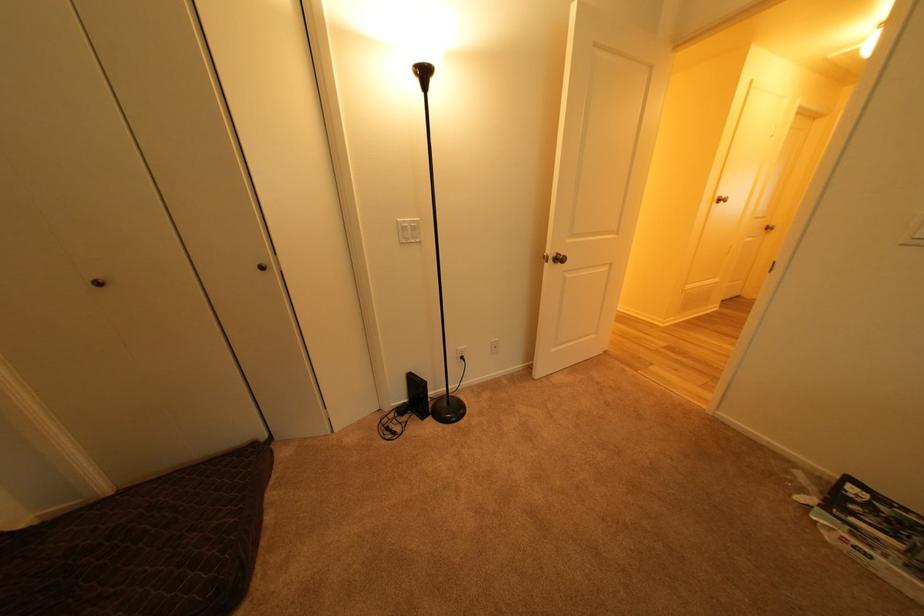
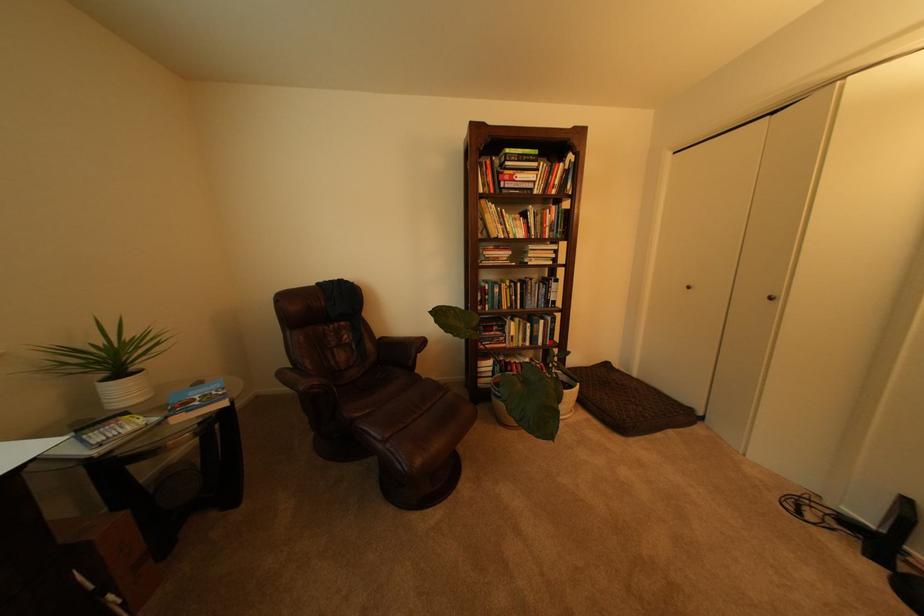
In the second image, find the point that corresponds to pixel 274 270 in the first image.

(782, 300)